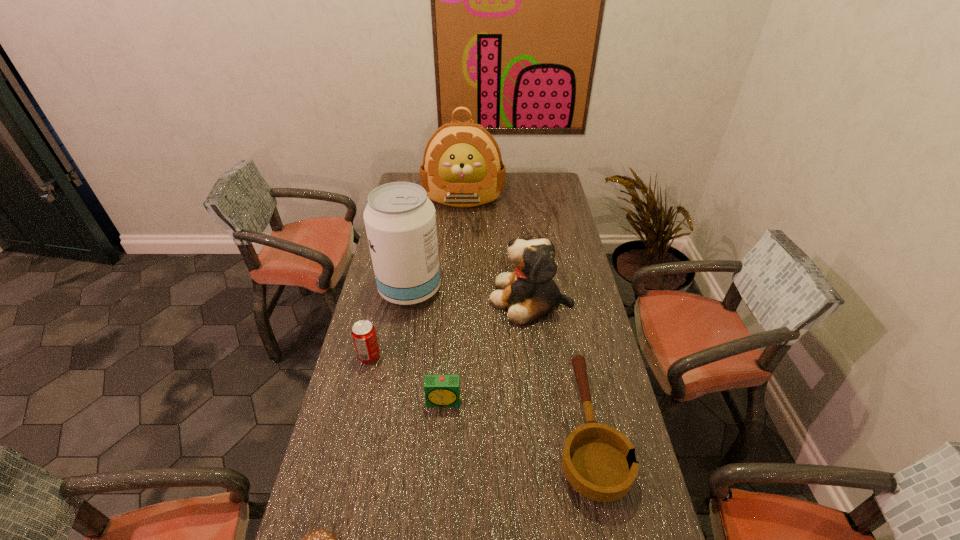
Where is `backpack`? backpack is located at coordinates (462, 166).

The image size is (960, 540). I want to click on alcohol, so 400,220.

Locate an element on the screen. This screenshot has width=960, height=540. puppy is located at coordinates (529, 292).

You are a GUI agent. You are given a task and a screenshot of the screen. Output one action in this format:
    pyautogui.click(x=<x>, y=<y>)
    Task: Click on the fourth farthest object
    
    Given the screenshot: What is the action you would take?
    pyautogui.click(x=363, y=333)

This screenshot has height=540, width=960. In order to click on soda in this screenshot , I will do [x=363, y=333].

Where is `the fifth tallest object`? This screenshot has width=960, height=540. the fifth tallest object is located at coordinates (440, 390).

Identify the location of saucepan. Image resolution: width=960 pixels, height=540 pixels. (599, 462).

You are a GUI agent. You are given a task and a screenshot of the screen. Output one action in this format:
    pyautogui.click(x=<x>, y=<y>)
    Task: Click on the vacant space located 0.210m on the front-facing side of the farthest object
    This screenshot has height=540, width=960.
    Given the screenshot: What is the action you would take?
    tap(461, 241)

Find the location of a particular element. Image resolution: width=960 pixels, height=540 pixels. vacant space located 0.130m on the front of the alcohol is located at coordinates (401, 339).

Where is `vacant point located 0.140m at the face of the puppy`? This screenshot has width=960, height=540. vacant point located 0.140m at the face of the puppy is located at coordinates (452, 299).